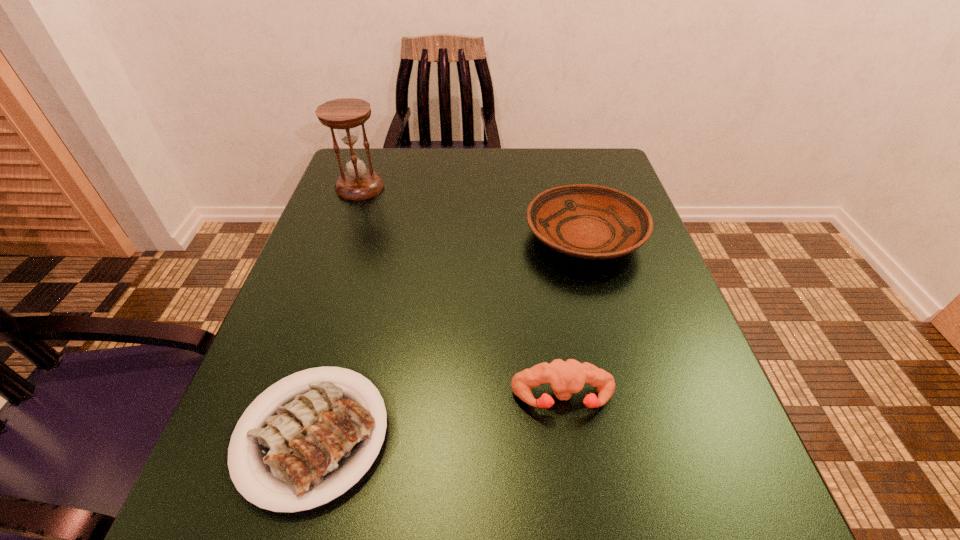
Find the location of a particular element. free space located 0.050m on the back of the shorter plate is located at coordinates (340, 339).

This screenshot has height=540, width=960. What are the coordinates of `object at the far edge` in the screenshot? It's located at (345, 115).

This screenshot has width=960, height=540. Identify the location of object that is at the near edge. (309, 444).

At what (x,y) coordinates should I click in order to perform the action: click on hourglass present at the left edge. Please return your answer as a coordinate pair (x, y). Looking at the image, I should click on (345, 115).

The width and height of the screenshot is (960, 540). Find the location of `plate positioned at the left edge`. plate positioned at the left edge is located at coordinates (309, 444).

Locate an element on the screen. puncher present at the right edge is located at coordinates (566, 377).

In order to click on plate that is at the right edge in this screenshot , I will do `click(586, 221)`.

Locate an element on the screen. The image size is (960, 540). object that is at the far left corner is located at coordinates (345, 115).

Image resolution: width=960 pixels, height=540 pixels. I want to click on object located at the near left corner, so click(309, 444).

Locate an element on the screen. The width and height of the screenshot is (960, 540). vacant region at the far edge is located at coordinates (513, 170).